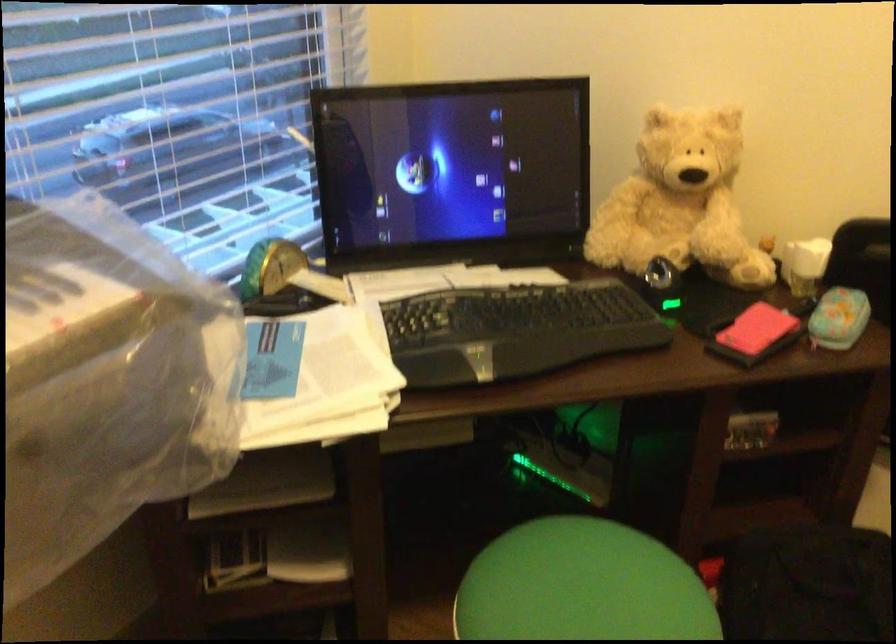
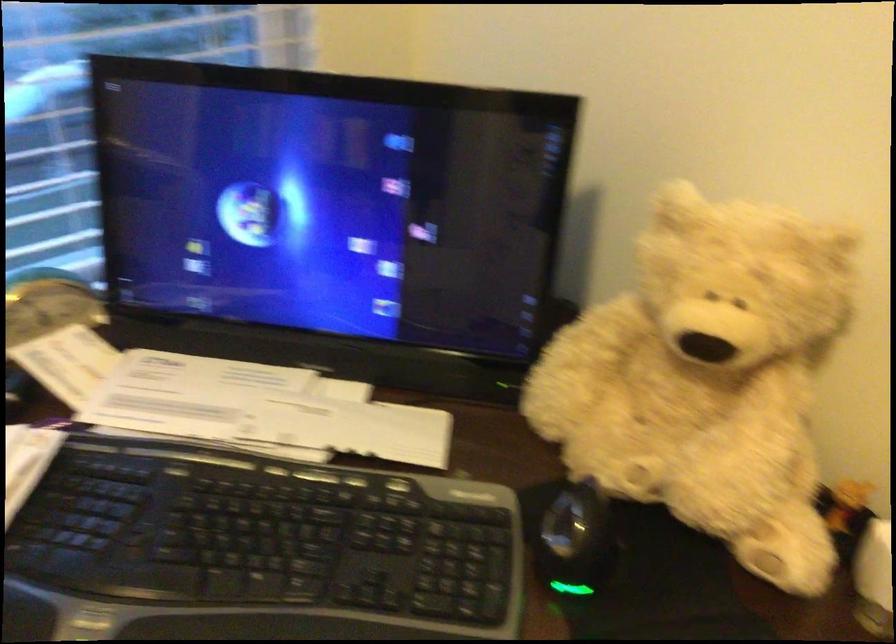
Question: The images are taken continuously from a first-person perspective. In which direction is your viewpoint rotating?

Choices:
 (A) Left
 (B) Right
 (C) Up
 (D) Down

Answer: (A)